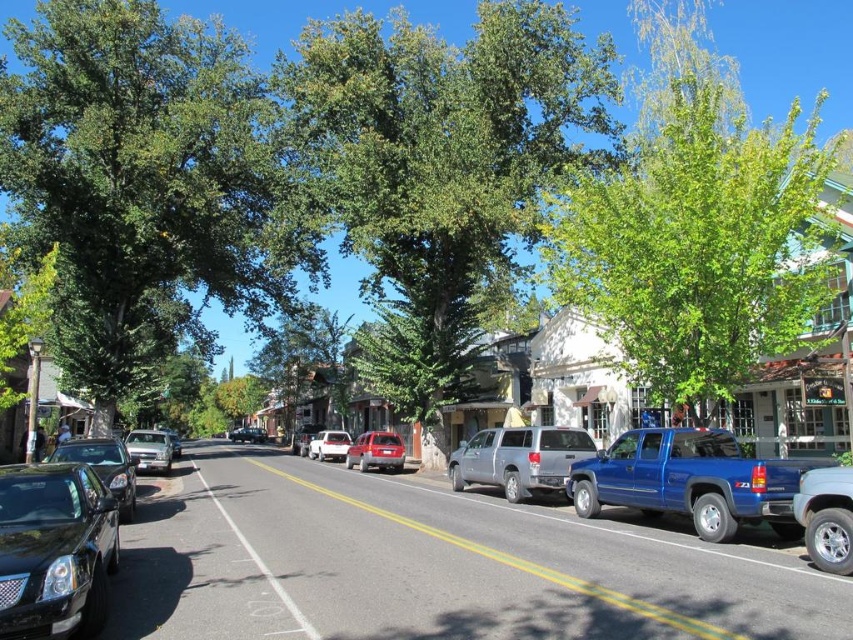
Does green leafy tree at upper right lie behind white asphalt road at center?

Yes.

Is green leafy tree at upper right in front of white asphalt road at center?

No, green leafy tree at upper right is further to the viewer.

Does point (705, 88) come behind point (257, 561)?

Yes, point (705, 88) is behind point (257, 561).

The width and height of the screenshot is (853, 640). I want to click on green leafy tree at upper right, so click(x=698, y=243).

Is satin red suv at center above satin silver sedan at center?

Yes, satin red suv at center is above satin silver sedan at center.

The width and height of the screenshot is (853, 640). What do you see at coordinates (376, 451) in the screenshot? I see `satin red suv at center` at bounding box center [376, 451].

Find the location of a particular element. satin red suv at center is located at coordinates point(376,451).

Between point (808, 225) and point (494, 472), which one is positioned in front?

Point (808, 225) is more forward.

Between green leafy tree at upper right and silver metallic suv at center, which one appears on the left side from the viewer's perspective?

Positioned to the left is silver metallic suv at center.

What do you see at coordinates (698, 243) in the screenshot?
I see `green leafy tree at upper right` at bounding box center [698, 243].

Where is `green leafy tree at upper right`? green leafy tree at upper right is located at coordinates (698, 243).